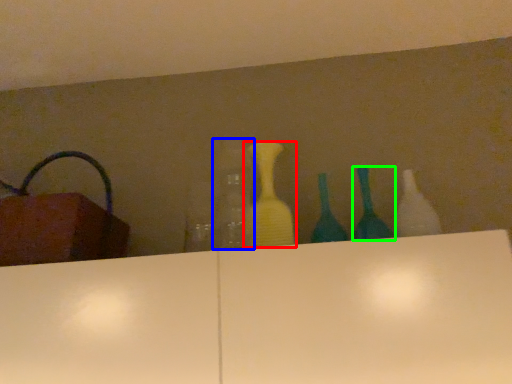
Question: Based on their relative distances, which object is nearer to bottle (highlighted by a red box)? Choose from bottle (highlighted by a blue box) and bottle (highlighted by a green box).

Choices:
 (A) bottle
 (B) bottle

Answer: (A)